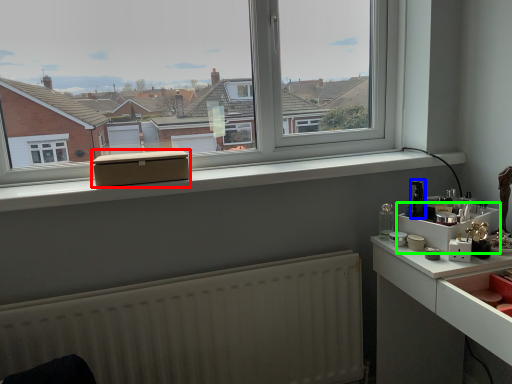
Question: Which is nearer to the box (highlighted by a red box)? appliance (highlighted by a blue box) or shelf (highlighted by a green box).

Choices:
 (A) appliance
 (B) shelf

Answer: (B)